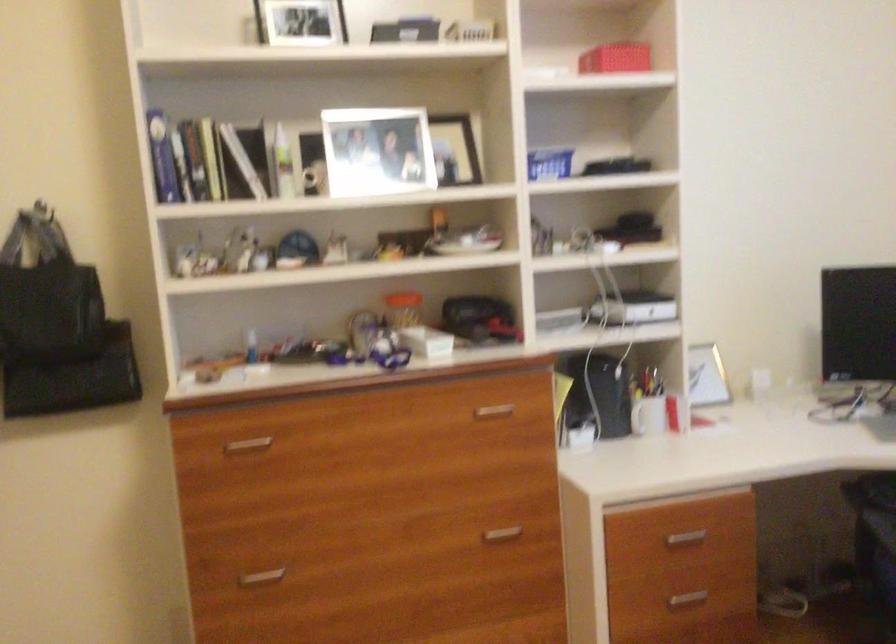
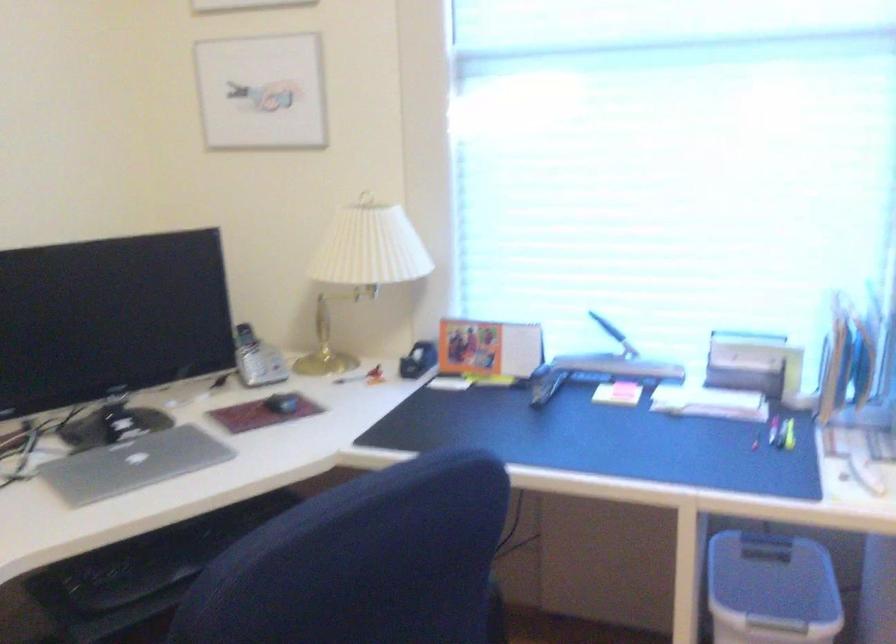
Question: The first image is from the beginning of the video and the second image is from the end. How did the camera likely rotate when shooting the video?

Choices:
 (A) Left
 (B) Right
 (C) Up
 (D) Down

Answer: (B)